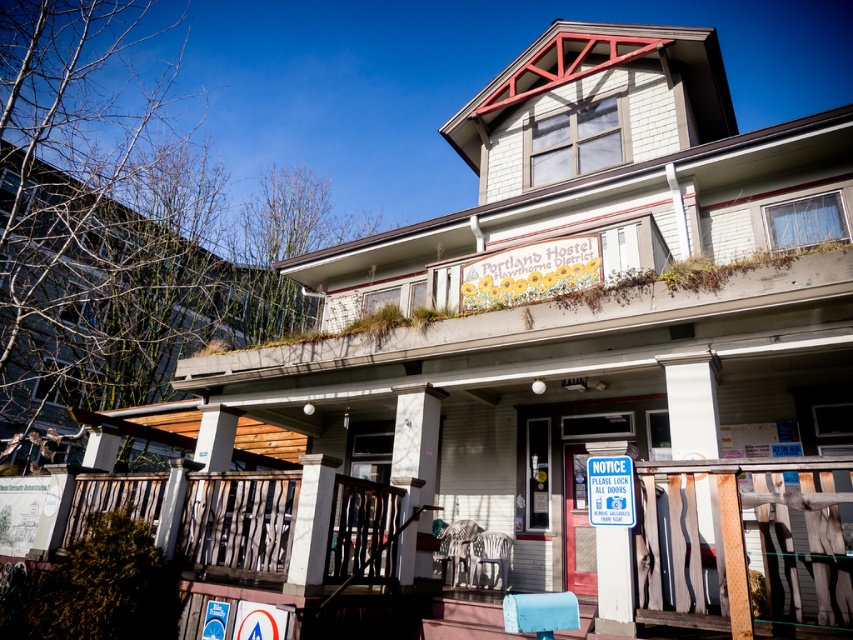
Between wooden at lower right and blue plastic sign at center, which one has less height?

blue plastic sign at center is shorter.

Can you confirm if wooden at lower right is smaller than blue plastic sign at center?

Incorrect, wooden at lower right is not smaller in size than blue plastic sign at center.

You are a GUI agent. You are given a task and a screenshot of the screen. Output one action in this format:
    pyautogui.click(x=<x>, y=<y>)
    Task: Click on the wooden at lower right
    
    Given the screenshot: What is the action you would take?
    pyautogui.click(x=744, y=545)